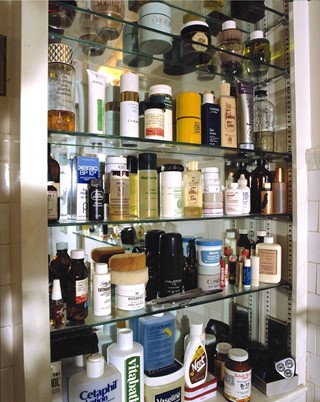
At what (x,y) coordinates should I click in order to perform the action: click on shelves. Please return your answer as a coordinate pair (x, y). Looking at the image, I should click on (250, 292), (218, 216), (200, 147), (195, 44).